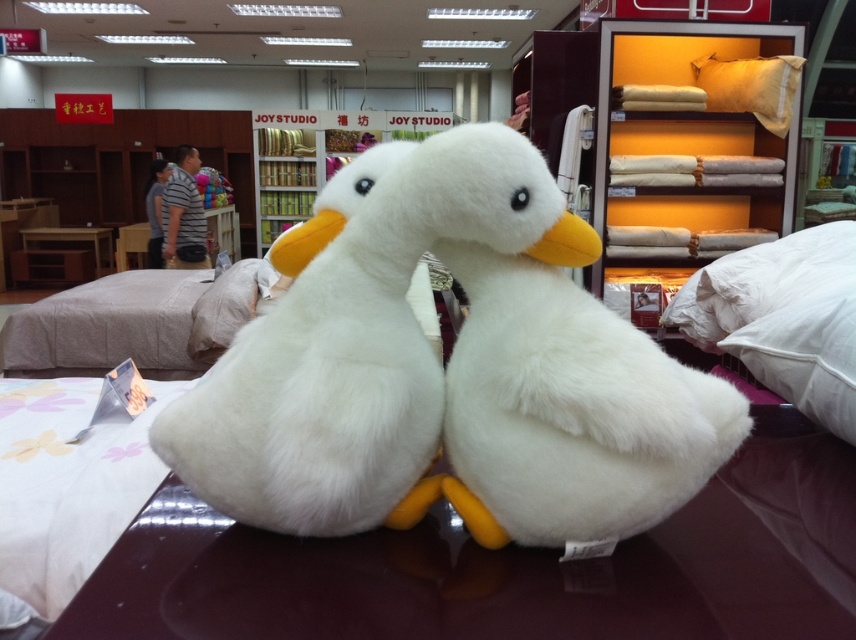
Question: Which object is farther from the camera taking this photo?

Choices:
 (A) yellow fabric bookshelf at upper right
 (B) white plush toy at center

Answer: (B)

Question: Which is farther from the wooden table at center?

Choices:
 (A) white plush duck at center
 (B) white plush toy at center
 (C) white soft pillow at center
 (D) white fluffy pillow at right

Answer: (D)

Question: Does white soft pillow at center have a smaller size compared to wooden table at center?

Choices:
 (A) no
 (B) yes

Answer: (A)

Question: Does white fluffy pillow at right appear under wooden table at center?

Choices:
 (A) yes
 (B) no

Answer: (A)

Question: Can you confirm if white fluffy pillow at right is thinner than beige soft pillow at upper right?

Choices:
 (A) yes
 (B) no

Answer: (A)

Question: Among these points, which one is nearest to the camera?

Choices:
 (A) (700, 61)
 (B) (37, 232)
 (C) (177, 253)

Answer: (A)